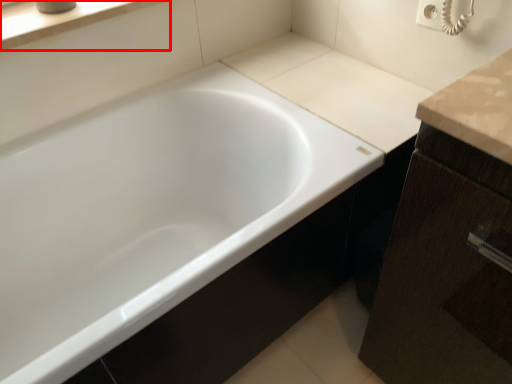
Question: In this image, where is window sill (annotated by the red box) located relative to bathtub?

Choices:
 (A) right
 (B) left

Answer: (B)